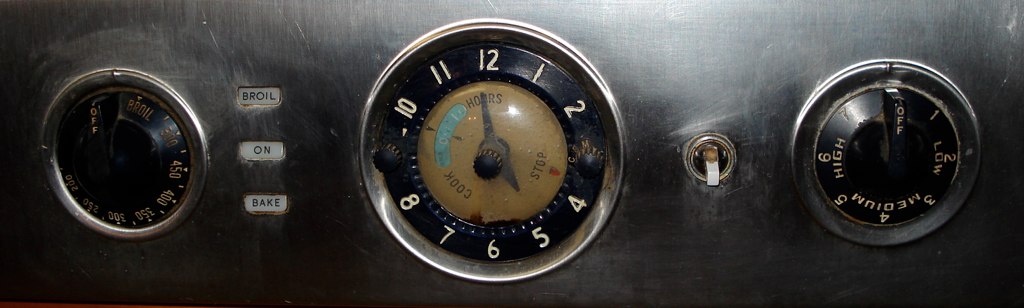
Where is `stainless steel panel`? The width and height of the screenshot is (1024, 308). stainless steel panel is located at coordinates (665, 62).